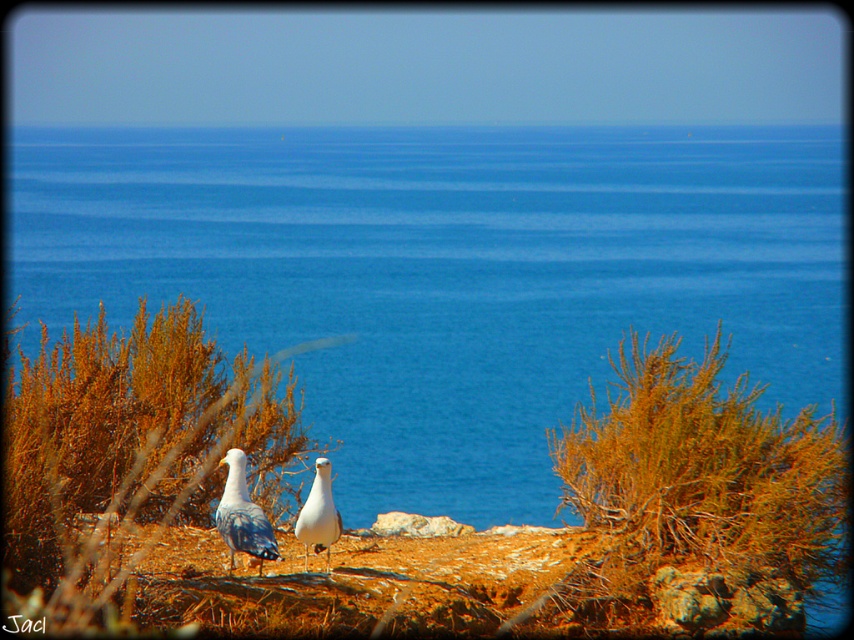
In the scene shown: You are standing at the edge of the cliff overlooking the ocean. You see the blue water at center and the white feathered seagull at lower center. If you want to throw a stone to hit both, which one should you aim for first, the one closer to you or the farther one?

The blue water at center and white feathered seagull at lower center are 39.40 meters apart from each other. Since the seagull is at lower center, it is closer to you than the water at center. Therefore, you should aim for the white feathered seagull at lower center first as it is nearer.

You are standing at the edge of the rocky outcrop where the seagulls are resting. You want to take a photo that includes both the seagulls and the ocean in the background. To ensure both elements are in focus, you need to adjust your camera settings. Considering the positions of point (21, 276) and point (256, 387), which point should you focus on to maximize the depth of field for both the seagulls and the ocean?

You should focus on point (21, 276) because it is closer to the camera than point (256, 387). By focusing on the closer point, the depth of field will extend further back, allowing both the seagulls on the rocky outcrop and the distant ocean to be in focus.